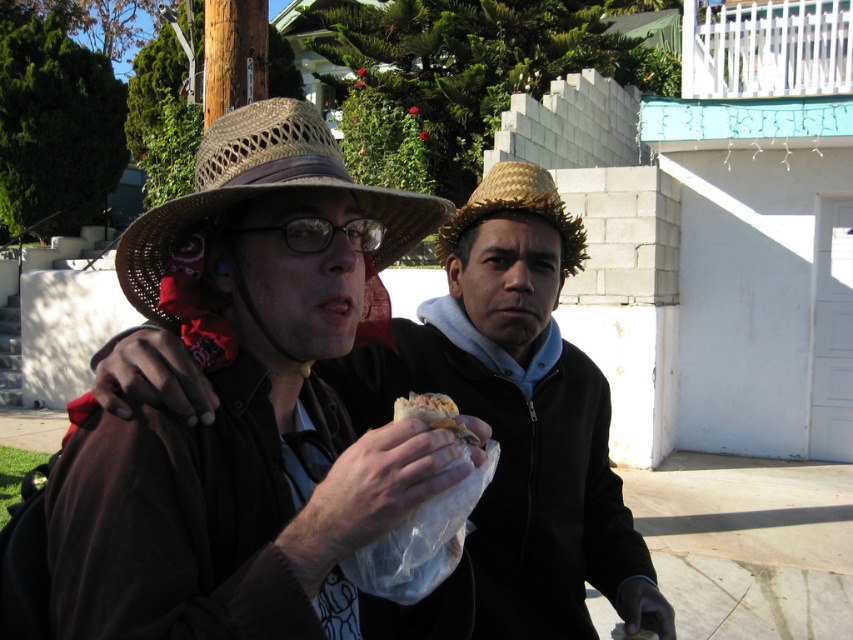
What are the coordinates of the matte brown hat at center?

The matte brown hat at center is located at point (x=518, y=413).